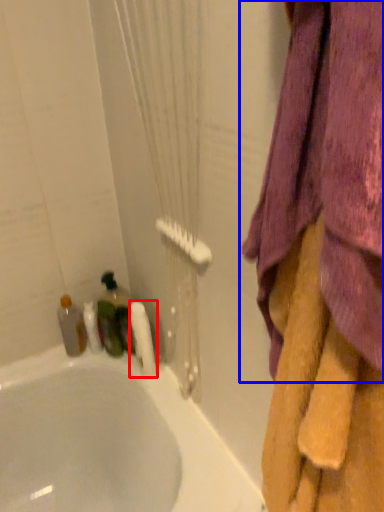
Question: Which of the following is the farthest to the observer, toilet paper (highlighted by a red box) or curtain (highlighted by a blue box)?

Choices:
 (A) toilet paper
 (B) curtain

Answer: (A)